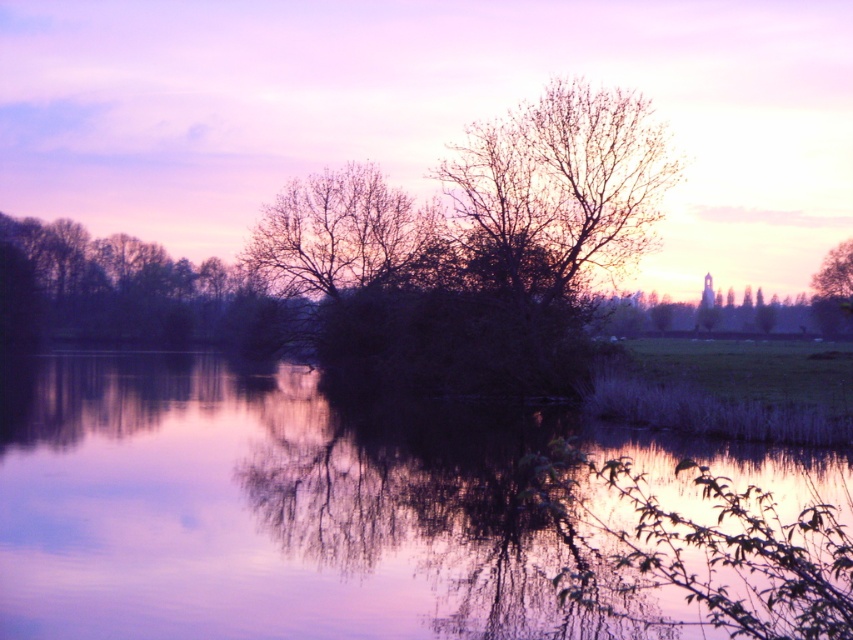
You are standing at the center of the image and want to locate the silhouette bare tree at left. According to the coordinates provided, in which direction should you look to find it?

The silhouette bare tree at left is located at coordinates point (128, 291), so you should look to the left side of the image.

You are standing at the point labeled as point (363,193) in the serene landscape scene. If you want to walk towards the water, which direction should you move relative to your current position?

Since the water is in the foreground of the scene, you should move forward from your current position at point (363,193) to reach the water.

You are an artist trying to paint the landscape. You notice the silhouette bare tree at left and the green matte tree at upper right. Which tree should you paint first if you want to follow the rule of painting taller objects before shorter ones?

You should paint the silhouette bare tree at left first because it is taller than the green matte tree at upper right.